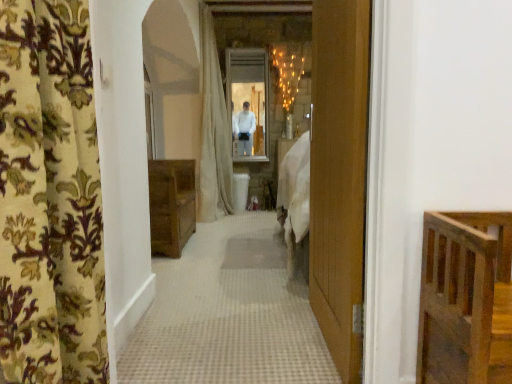
Question: From a real-world perspective, is beige fabric shower curtain at center below floral-patterned fabric at left?

Choices:
 (A) yes
 (B) no

Answer: (B)

Question: Is beige fabric shower curtain at center completely or partially outside of floral-patterned fabric at left?

Choices:
 (A) no
 (B) yes

Answer: (B)

Question: From the image's perspective, is beige fabric shower curtain at center above floral-patterned fabric at left?

Choices:
 (A) no
 (B) yes

Answer: (B)

Question: Is beige fabric shower curtain at center smaller than floral-patterned fabric at left?

Choices:
 (A) yes
 (B) no

Answer: (B)

Question: Can you confirm if beige fabric shower curtain at center is taller than floral-patterned fabric at left?

Choices:
 (A) no
 (B) yes

Answer: (B)

Question: From a real-world perspective, relative to beige fabric shower curtain at center, is white glossy mirror at center vertically above or below?

Choices:
 (A) below
 (B) above

Answer: (B)

Question: Considering the positions of white glossy mirror at center and beige fabric shower curtain at center in the image, is white glossy mirror at center bigger or smaller than beige fabric shower curtain at center?

Choices:
 (A) small
 (B) big

Answer: (A)

Question: Choose the correct answer: Is white glossy mirror at center inside beige fabric shower curtain at center or outside it?

Choices:
 (A) outside
 (B) inside

Answer: (B)

Question: Considering the positions of white glossy mirror at center and beige fabric shower curtain at center in the image, is white glossy mirror at center taller or shorter than beige fabric shower curtain at center?

Choices:
 (A) tall
 (B) short

Answer: (B)

Question: Is floral-patterned fabric at left spatially inside beige fabric shower curtain at center, or outside of it?

Choices:
 (A) inside
 (B) outside

Answer: (B)

Question: From a real-world perspective, is floral-patterned fabric at left positioned above or below beige fabric shower curtain at center?

Choices:
 (A) above
 (B) below

Answer: (B)

Question: Is point (86, 327) positioned closer to the camera than point (210, 147)?

Choices:
 (A) closer
 (B) farther

Answer: (A)

Question: Is floral-patterned fabric at left taller or shorter than beige fabric shower curtain at center?

Choices:
 (A) tall
 (B) short

Answer: (B)

Question: Visually, is beige fabric shower curtain at center positioned to the left or to the right of white glossy mirror at center?

Choices:
 (A) left
 (B) right

Answer: (A)

Question: From a real-world perspective, is beige fabric shower curtain at center physically located above or below white glossy mirror at center?

Choices:
 (A) below
 (B) above

Answer: (A)